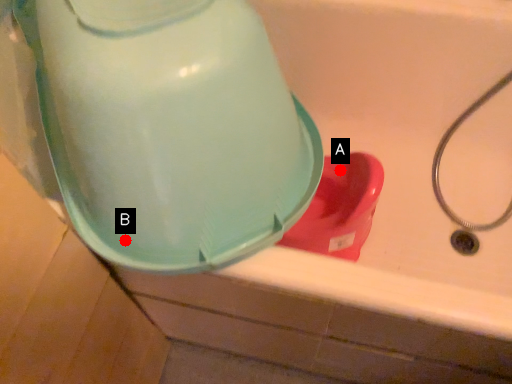
Question: Two points are circled on the image, labeled by A and B beside each circle. Which point is further to the camera?

Choices:
 (A) A is further
 (B) B is further

Answer: (A)